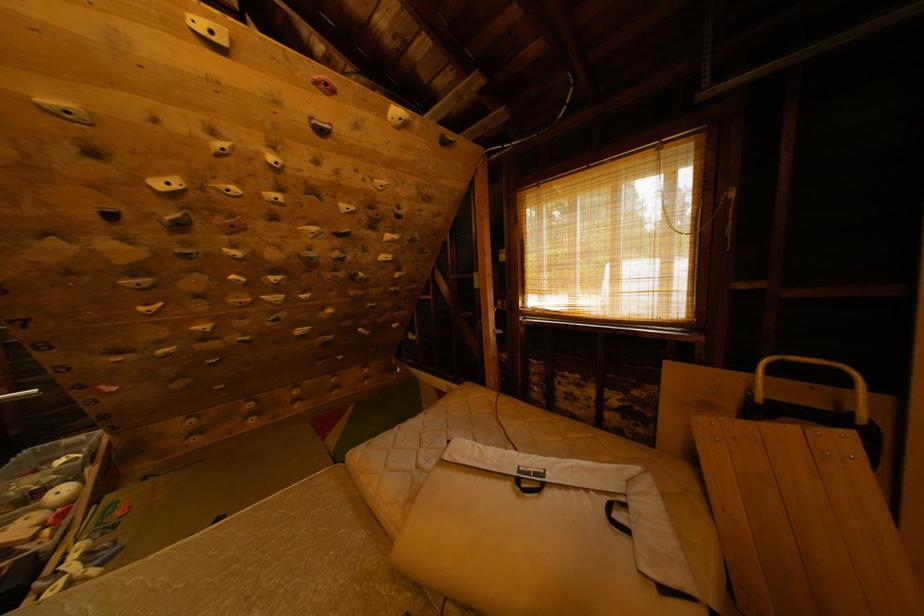
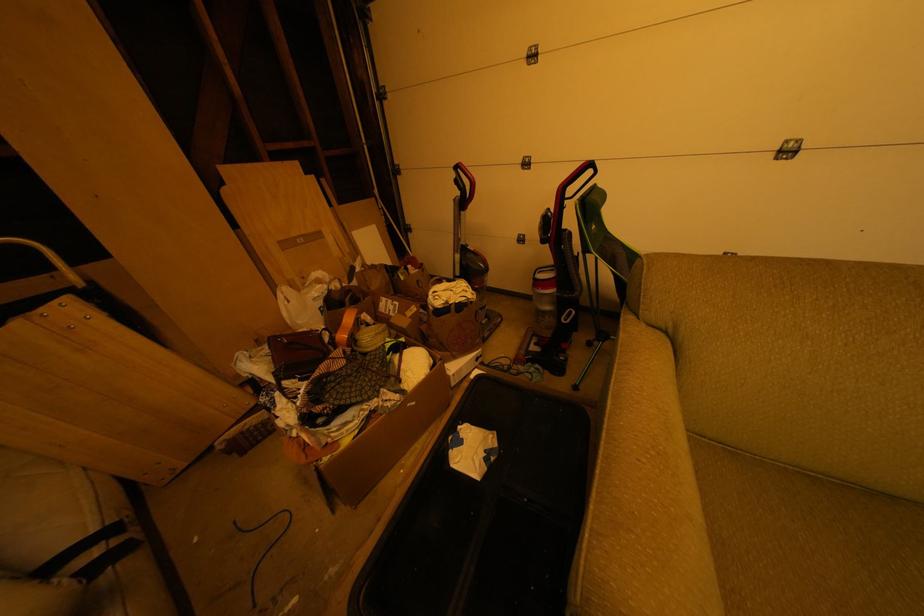
Looking at this image, the first image is from the beginning of the video and the second image is from the end. How did the camera likely rotate when shooting the video?

The camera rotated toward right-down.